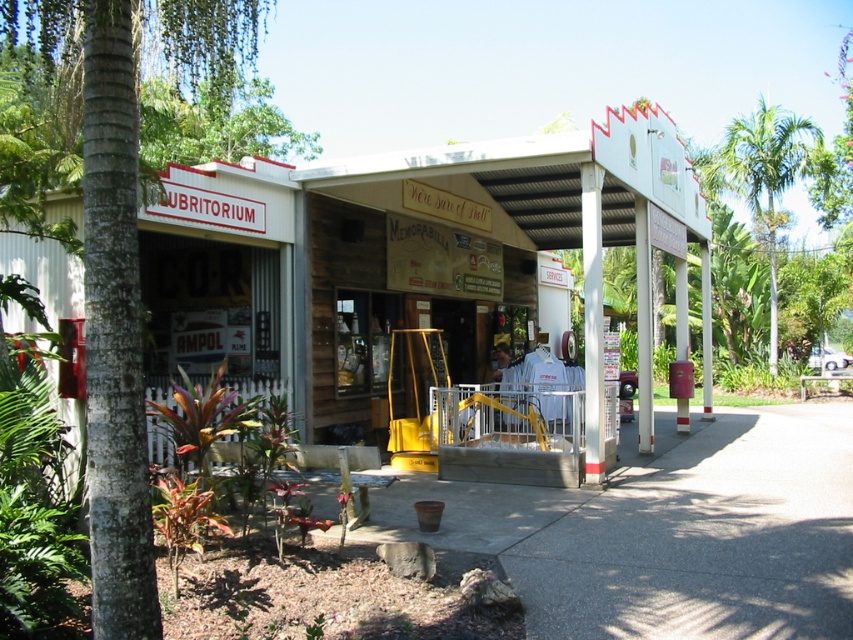
Question: Considering the relative positions of wooden signboard at center and green leafy palm tree at upper right in the image provided, where is wooden signboard at center located with respect to green leafy palm tree at upper right?

Choices:
 (A) below
 (B) above

Answer: (A)

Question: Which object appears farthest from the camera in this image?

Choices:
 (A) green leafy palm tree at upper right
 (B) wooden signboard at center

Answer: (A)

Question: Among these points, which one is nearest to the camera?

Choices:
 (A) (498, 324)
 (B) (761, 148)

Answer: (A)

Question: Which of the following is the farthest from the observer?

Choices:
 (A) green leafy palm tree at upper right
 (B) wooden signboard at center

Answer: (A)

Question: Does wooden signboard at center have a lesser width compared to green leafy palm tree at upper right?

Choices:
 (A) yes
 (B) no

Answer: (B)

Question: Can you confirm if wooden signboard at center is smaller than green leafy palm tree at upper right?

Choices:
 (A) yes
 (B) no

Answer: (B)